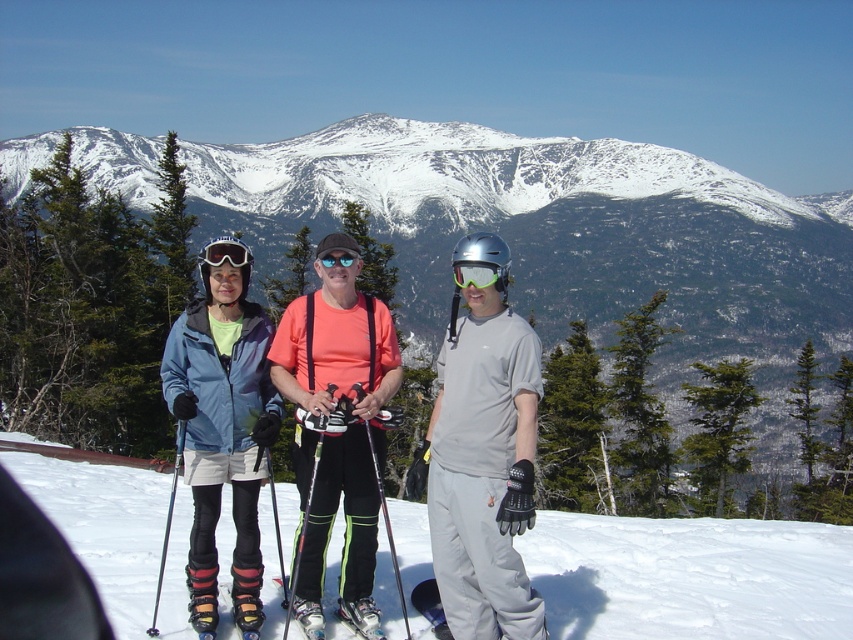
Looking at this image, can you confirm if orange t-shirt at center is thinner than metallic silver ski pole at center?

No.

This screenshot has height=640, width=853. What do you see at coordinates (335, 433) in the screenshot? I see `orange t-shirt at center` at bounding box center [335, 433].

Which is in front, point (310, 305) or point (387, 541)?

Point (387, 541)

Find the location of a particular element. orange t-shirt at center is located at coordinates (335, 433).

Is point (459, 275) positioned before point (367, 429)?

No, (459, 275) is further to viewer.

Consider the image. Between transparent plastic goggles at center and metallic silver ski pole at center, which one has less height?

With less height is transparent plastic goggles at center.

Does point (503, 285) come closer to viewer compared to point (401, 598)?

No, (503, 285) is further to viewer.

Locate an element on the screen. Image resolution: width=853 pixels, height=640 pixels. transparent plastic goggles at center is located at coordinates coord(480,275).

Does point (489, 275) come in front of point (344, 262)?

Yes, it is in front of point (344, 262).

You are a GUI agent. You are given a task and a screenshot of the screen. Output one action in this format:
    pyautogui.click(x=<x>, y=<y>)
    Task: Click on the transparent plastic goggles at center
    
    Given the screenshot: What is the action you would take?
    pyautogui.click(x=480, y=275)